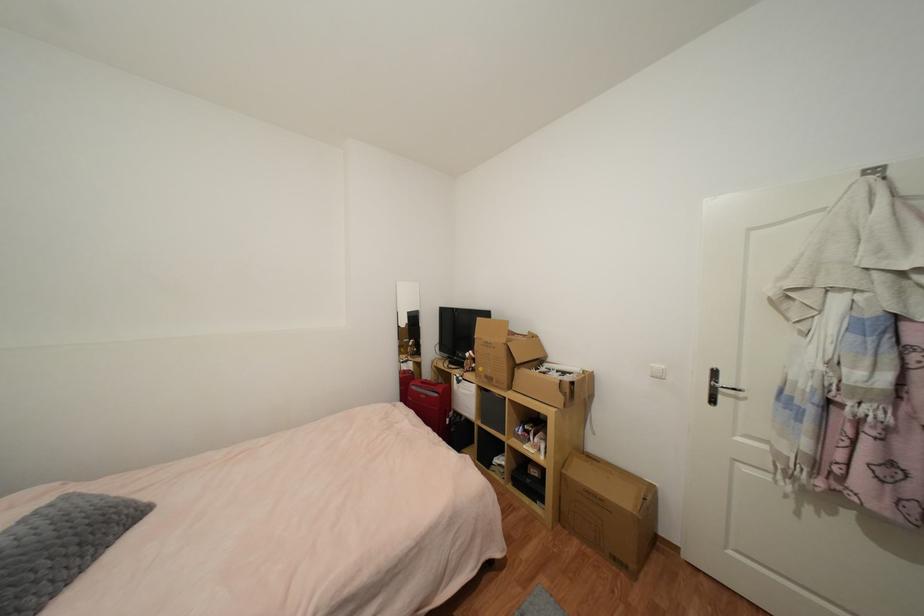
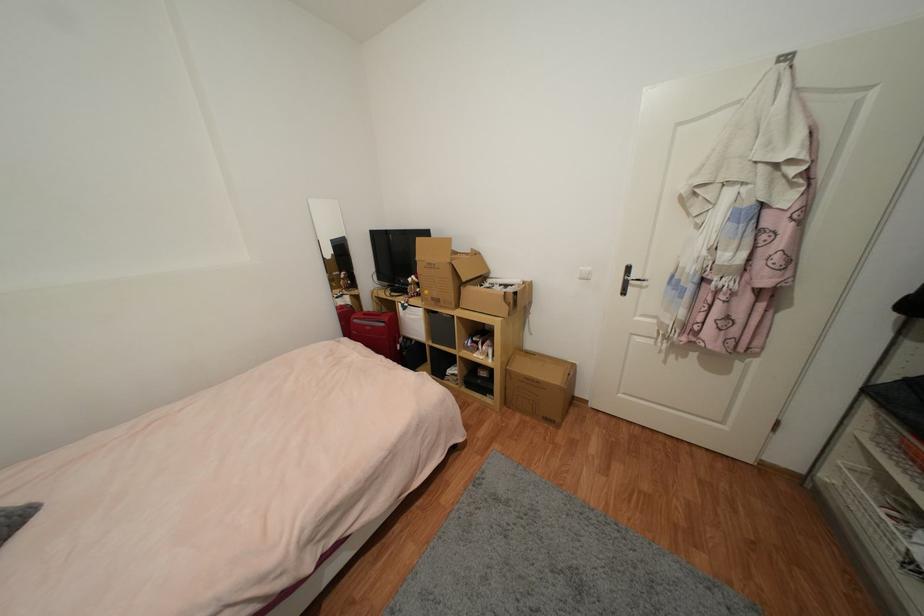
The images are taken continuously from a first-person perspective. In which direction are you moving?

The movement direction of the cameraman is left, forward.